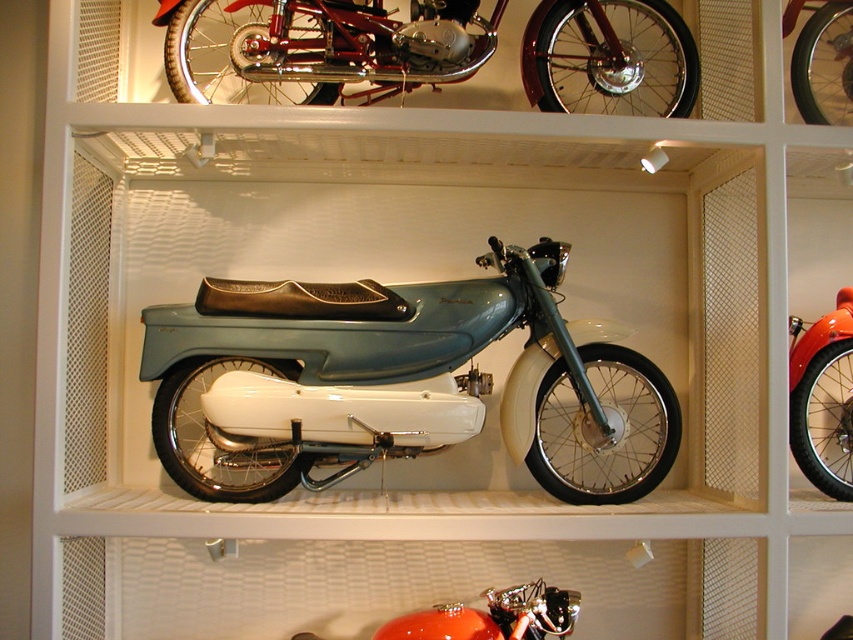
Is shiny red motorcycle at center below orange glossy motorcycle at lower center?

No.

Between point (834, 317) and point (570, 620), which one is positioned in front?

Point (570, 620)

Find the location of `shiny red motorcycle at center`. shiny red motorcycle at center is located at coordinates (822, 397).

Does teal matte/metallic motorcycle at center have a lesser width compared to orange glossy motorcycle at lower center?

In fact, teal matte/metallic motorcycle at center might be wider than orange glossy motorcycle at lower center.

Is teal matte/metallic motorcycle at center closer to the viewer compared to orange glossy motorcycle at lower center?

No.

The width and height of the screenshot is (853, 640). Identify the location of teal matte/metallic motorcycle at center. click(x=399, y=381).

Which is behind, point (177, 38) or point (850, 332)?

Positioned behind is point (850, 332).

Measure the distance between shiny chrome motorcycle at upper center and shiny red motorcycle at center.

shiny chrome motorcycle at upper center and shiny red motorcycle at center are 29.76 inches apart from each other.

Locate an element on the screen. The height and width of the screenshot is (640, 853). shiny chrome motorcycle at upper center is located at coordinates (312, 49).

Find the location of a particular element. shiny chrome motorcycle at upper center is located at coordinates (312, 49).